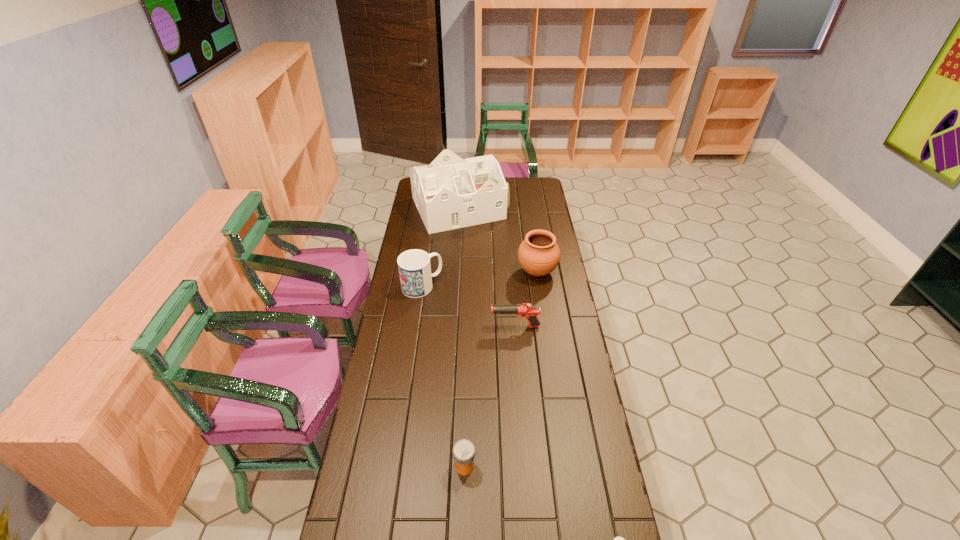
Identify the location of the farthest object. This screenshot has height=540, width=960. (450, 193).

This screenshot has width=960, height=540. Find the location of `dollhouse`. dollhouse is located at coordinates (450, 193).

You are a GUI agent. You are given a task and a screenshot of the screen. Output one action in this format:
    pyautogui.click(x=<x>, y=<y>)
    Task: Click on the second tallest object
    The width and height of the screenshot is (960, 540).
    Given the screenshot: What is the action you would take?
    pyautogui.click(x=538, y=255)

The width and height of the screenshot is (960, 540). I want to click on mug, so click(x=414, y=267).

Where is `gun`? The height and width of the screenshot is (540, 960). gun is located at coordinates (526, 310).

The width and height of the screenshot is (960, 540). I want to click on the third shortest object, so click(x=526, y=310).

Locate an element on the screen. the second nearest object is located at coordinates (463, 451).

Find the location of a particular element. the left medicine is located at coordinates pos(463,451).

Find the location of a particular element. The image size is (960, 540). blank area located 0.130m on the right of the farthest object is located at coordinates pos(532,208).

This screenshot has height=540, width=960. I want to click on vacant area situated on the front of the pottery, so click(x=540, y=295).